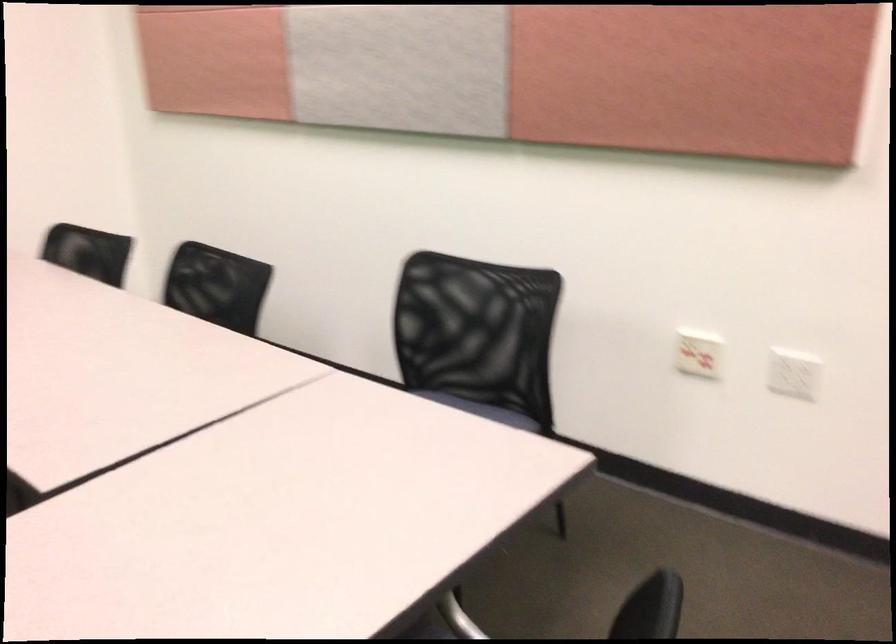
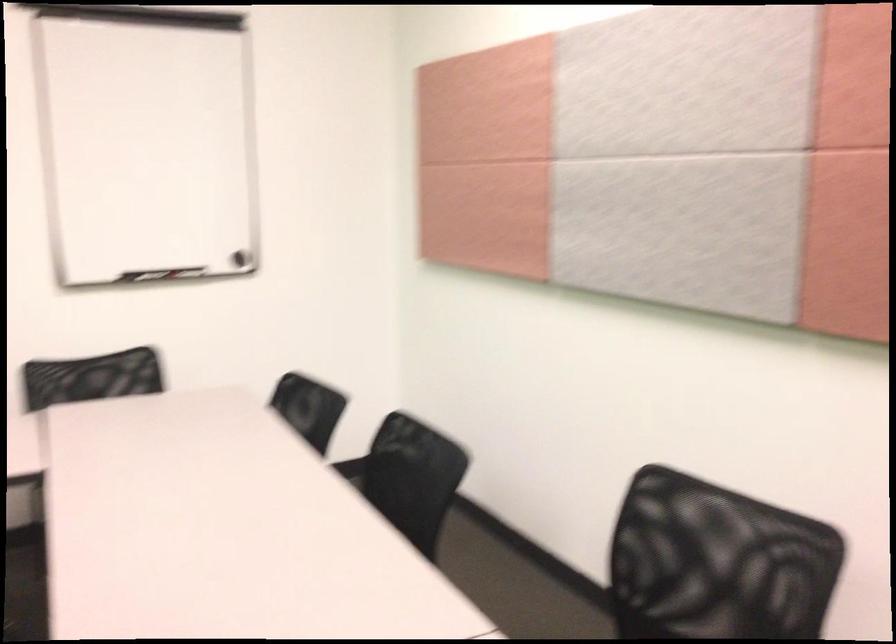
Find the pixel in the second image that matches [470,321] in the first image.

(717, 563)